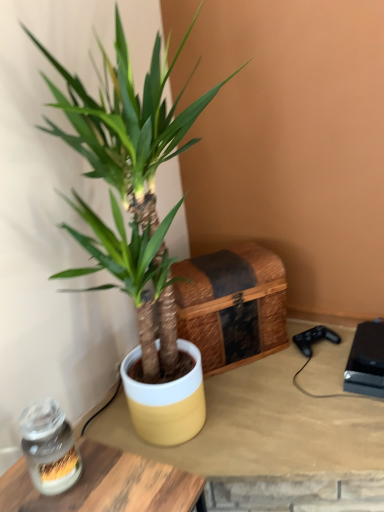
Question: Is green matte plant at center positioned in front of black plastic game console at lower right?

Choices:
 (A) yes
 (B) no

Answer: (A)

Question: Considering the relative sizes of green matte plant at center and black plastic game console at lower right in the image provided, is green matte plant at center smaller than black plastic game console at lower right?

Choices:
 (A) no
 (B) yes

Answer: (A)

Question: Is green matte plant at center wider than black plastic game console at lower right?

Choices:
 (A) yes
 (B) no

Answer: (A)

Question: From a real-world perspective, is green matte plant at center located higher than black plastic game console at lower right?

Choices:
 (A) no
 (B) yes

Answer: (B)

Question: From the image's perspective, is green matte plant at center under black plastic game console at lower right?

Choices:
 (A) no
 (B) yes

Answer: (A)

Question: In terms of height, does woven wood chest at center look taller or shorter compared to clear glass jar at lower left?

Choices:
 (A) short
 (B) tall

Answer: (B)

Question: From the image's perspective, is woven wood chest at center located above or below clear glass jar at lower left?

Choices:
 (A) below
 (B) above

Answer: (B)

Question: From a real-world perspective, is woven wood chest at center physically located above or below clear glass jar at lower left?

Choices:
 (A) below
 (B) above

Answer: (A)

Question: Is woven wood chest at center situated inside clear glass jar at lower left or outside?

Choices:
 (A) outside
 (B) inside

Answer: (A)

Question: Does point (211, 367) appear closer or farther from the camera than point (352, 351)?

Choices:
 (A) farther
 (B) closer

Answer: (A)

Question: Visually, is woven wood chest at center positioned to the left or to the right of black plastic game console at lower right?

Choices:
 (A) right
 (B) left

Answer: (B)

Question: From the image's perspective, is woven wood chest at center positioned above or below black plastic game console at lower right?

Choices:
 (A) below
 (B) above

Answer: (B)

Question: Is woven wood chest at center inside the boundaries of black plastic game console at lower right, or outside?

Choices:
 (A) outside
 (B) inside

Answer: (A)

Question: Does point (339, 332) appear closer or farther from the camera than point (49, 425)?

Choices:
 (A) farther
 (B) closer

Answer: (A)

Question: Would you say yellow matte pot at center, which is counted as the 2th table, starting from the front, is to the left or to the right of clear glass jar at lower left in the picture?

Choices:
 (A) right
 (B) left

Answer: (A)